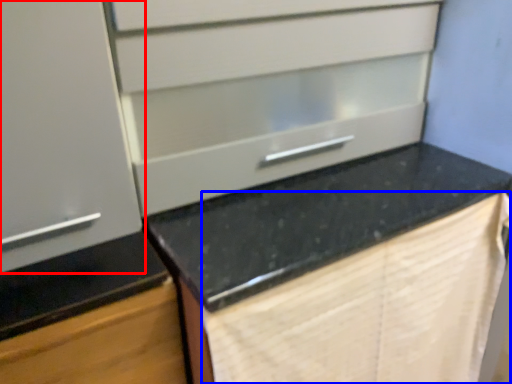
Question: Which object is further to the camera taking this photo, cabinetry (highlighted by a red box) or blanket (highlighted by a blue box)?

Choices:
 (A) cabinetry
 (B) blanket

Answer: (B)